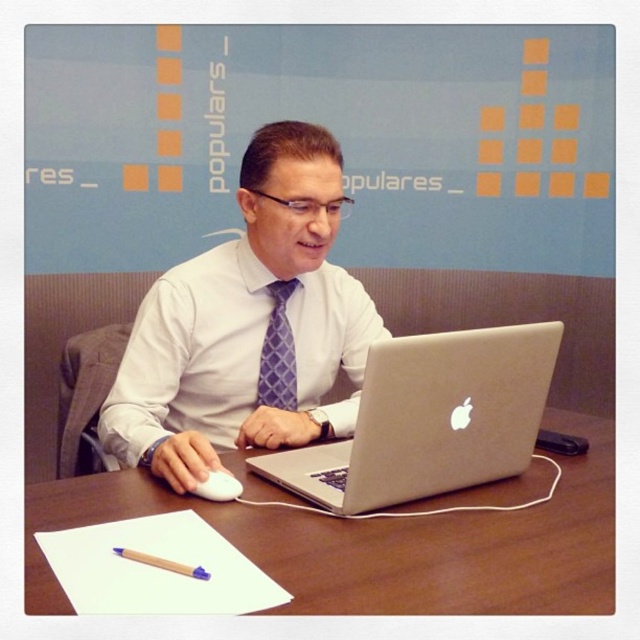
Can you confirm if silver metallic laptop at center is positioned to the left of white matte mouse at lower left?

Incorrect, silver metallic laptop at center is not on the left side of white matte mouse at lower left.

Is silver metallic laptop at center smaller than white matte mouse at lower left?

No.

Does point (516, 349) come farther from viewer compared to point (221, 477)?

Yes, it is behind point (221, 477).

At what (x,y) coordinates should I click in order to perform the action: click on silver metallic laptop at center. Please return your answer as a coordinate pair (x, y). Image resolution: width=640 pixels, height=640 pixels. Looking at the image, I should click on (429, 420).

Who is lower down, wooden table at center or purple textured tie at center?

Positioned lower is wooden table at center.

In the scene shown: Does wooden table at center have a greater width compared to purple textured tie at center?

Yes.

What do you see at coordinates (381, 544) in the screenshot? The image size is (640, 640). I see `wooden table at center` at bounding box center [381, 544].

Where is `wooden table at center`? wooden table at center is located at coordinates (381, 544).

Between white matte mouse at lower left and wooden pencil at lower left, which one appears on the left side from the viewer's perspective?

From the viewer's perspective, wooden pencil at lower left appears more on the left side.

Does white matte mouse at lower left come behind wooden pencil at lower left?

Yes, it is behind wooden pencil at lower left.

The height and width of the screenshot is (640, 640). I want to click on white matte mouse at lower left, so [x=218, y=486].